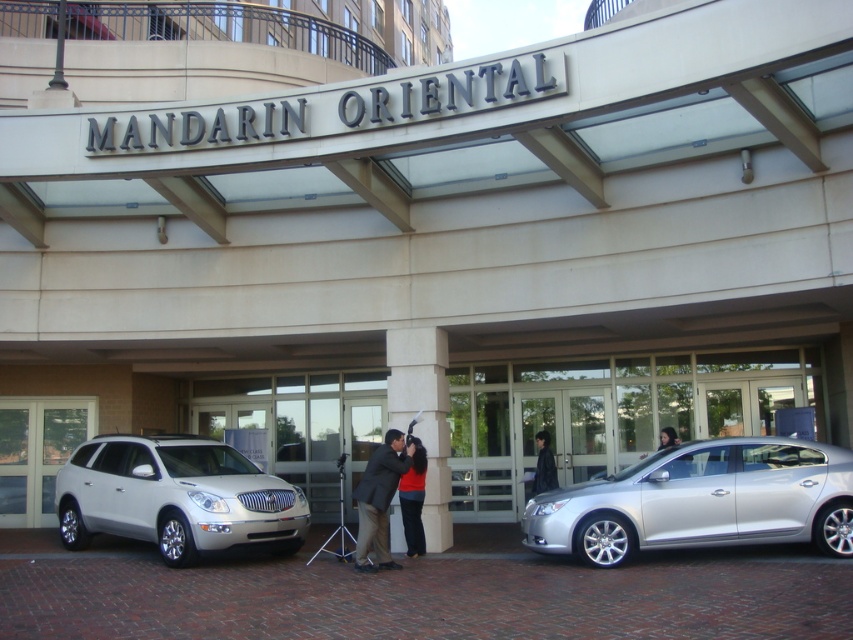
Who is taller, red matte shirt at center or black leather jacket at center?

Standing taller between the two is red matte shirt at center.

Can you confirm if red matte shirt at center is wider than black leather jacket at center?

Yes, red matte shirt at center is wider than black leather jacket at center.

Is point (421, 486) closer to camera compared to point (540, 492)?

Yes, it is.

This screenshot has height=640, width=853. Find the location of `red matte shirt at center`. red matte shirt at center is located at coordinates (413, 499).

Who is lower down, silver metallic tripod at center or black leather jacket at center?

silver metallic tripod at center is lower down.

Does point (323, 550) lie in front of point (534, 436)?

Yes, it is in front of point (534, 436).

Where is `silver metallic tripod at center`? This screenshot has width=853, height=640. silver metallic tripod at center is located at coordinates (338, 524).

Is silver metallic suv at left to the left of silver metallic tripod at center from the viewer's perspective?

Indeed, silver metallic suv at left is positioned on the left side of silver metallic tripod at center.

Does point (120, 484) come farther from viewer compared to point (329, 538)?

No, it is in front of (329, 538).

Locate an element on the screen. This screenshot has height=640, width=853. silver metallic suv at left is located at coordinates (175, 497).